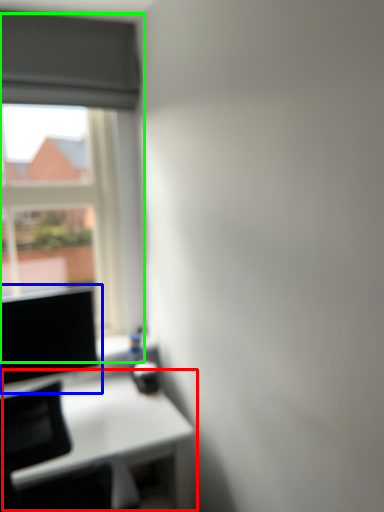
Question: Based on their relative distances, which object is farther from table (highlighted by a red box)? Choose from computer screen (highlighted by a blue box) and window (highlighted by a green box).

Choices:
 (A) computer screen
 (B) window

Answer: (B)